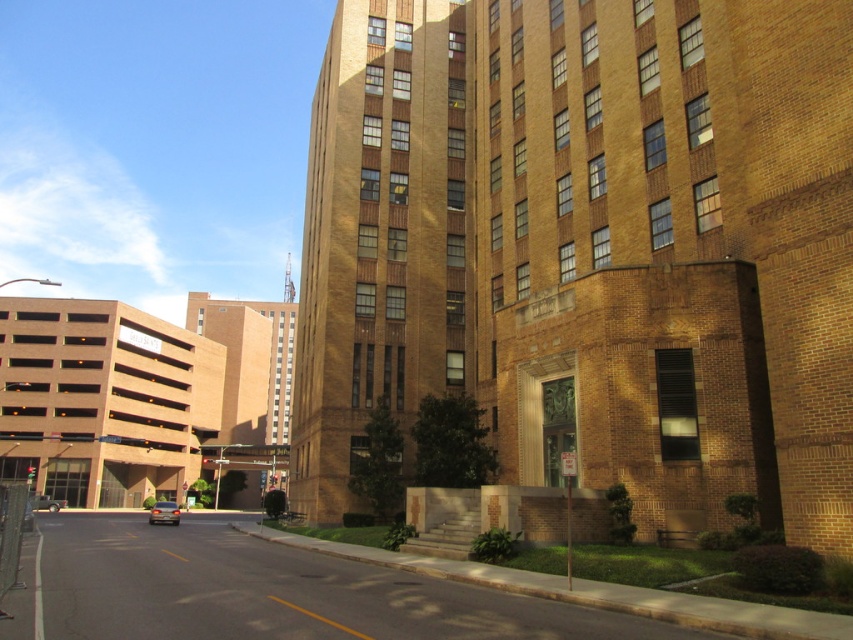
Question: Does shiny silver sedan at center have a smaller size compared to silver metallic car at lower left?

Choices:
 (A) yes
 (B) no

Answer: (B)

Question: Is shiny silver sedan at center thinner than silver metallic car at lower left?

Choices:
 (A) no
 (B) yes

Answer: (A)

Question: Is shiny silver sedan at center smaller than silver metallic car at lower left?

Choices:
 (A) yes
 (B) no

Answer: (B)

Question: Which object appears closest to the camera in this image?

Choices:
 (A) shiny silver sedan at center
 (B) silver metallic car at lower left

Answer: (A)

Question: Which object is farther from the camera taking this photo?

Choices:
 (A) shiny silver sedan at center
 (B) silver metallic car at lower left

Answer: (B)